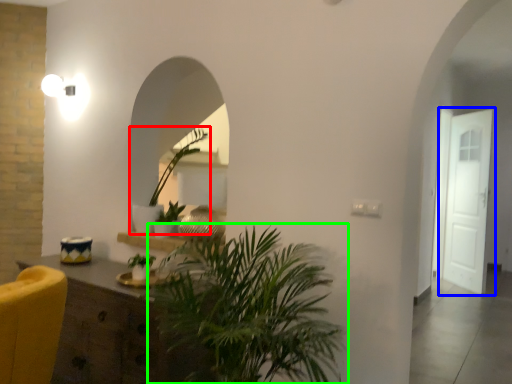
Question: Which is nearer to the houseplant (highlighted by a red box)? door (highlighted by a blue box) or houseplant (highlighted by a green box).

Choices:
 (A) door
 (B) houseplant

Answer: (B)